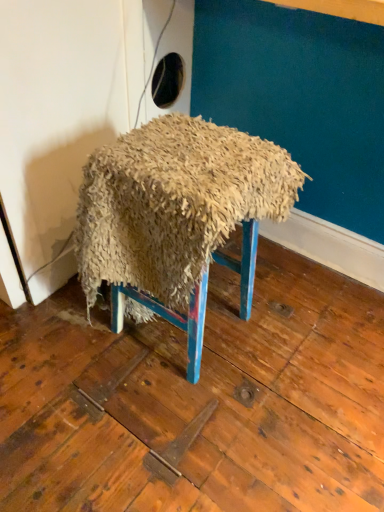
Image resolution: width=384 pixels, height=512 pixels. In order to click on vacant area on top of fuzzy straw stool at center (from a real-world perspective) in this screenshot , I will do `click(192, 150)`.